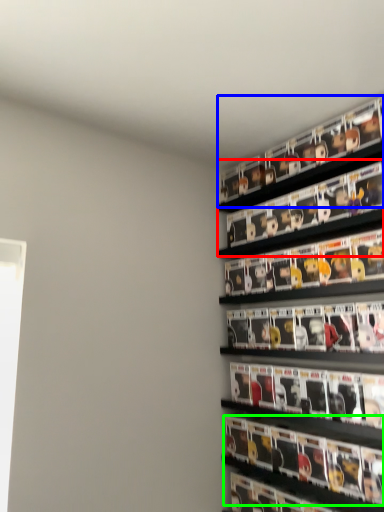
Question: Which is nearer to the shelf (highlighted by a red box)? shelf (highlighted by a blue box) or magazine (highlighted by a green box).

Choices:
 (A) shelf
 (B) magazine

Answer: (A)